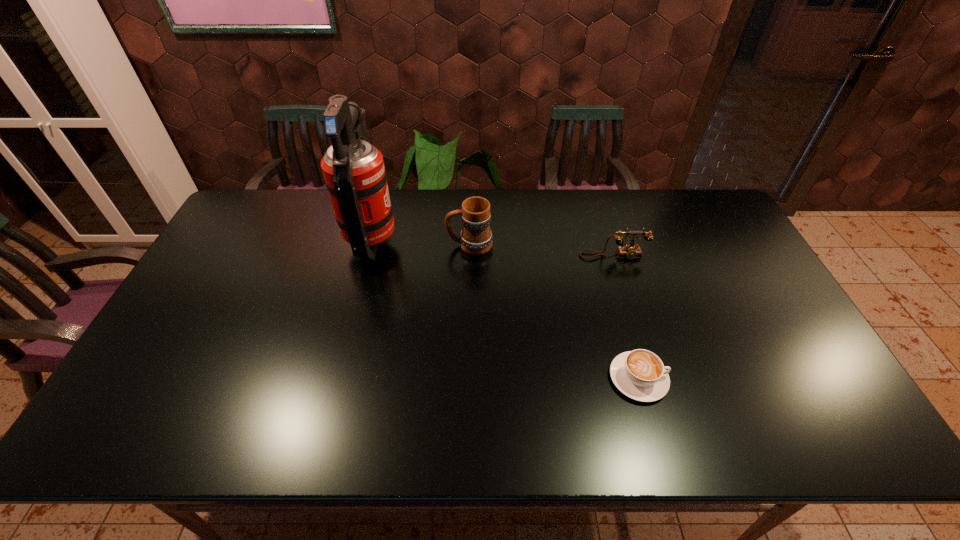
Identify the location of free space that satisfies the following two spatial constraints: 1. on the front-facing side of the third tallest object; 2. on the side of the shortest object with the handle. (651, 379).